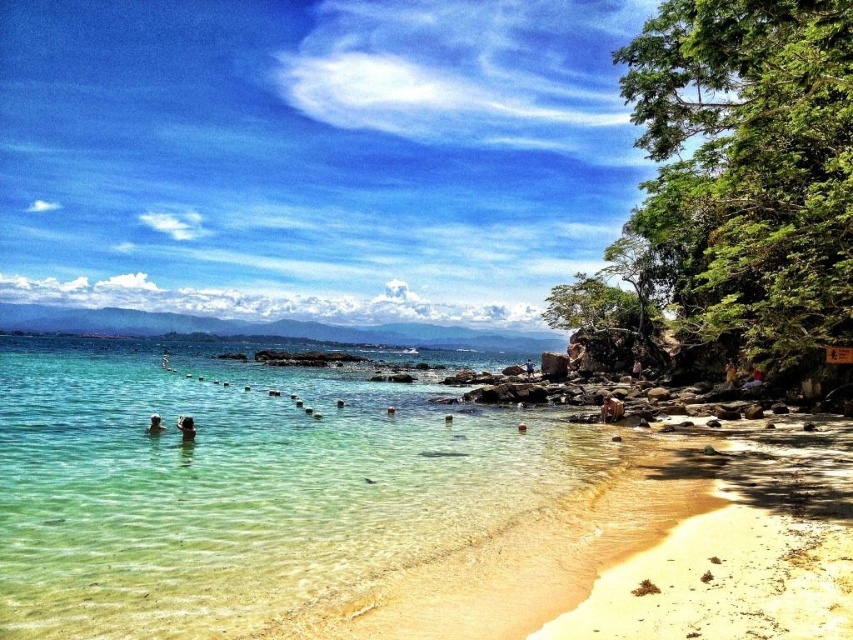
Question: Can you confirm if clear water at beach left is smaller than brown textured person at lower right?

Choices:
 (A) no
 (B) yes

Answer: (A)

Question: Which point is closer to the camera?

Choices:
 (A) (186, 429)
 (B) (157, 420)
 (C) (622, 413)

Answer: (A)

Question: Is brown furry dog at lower right to the left of light brown skin at lower left from the viewer's perspective?

Choices:
 (A) yes
 (B) no

Answer: (B)

Question: In this image, where is brown textured person at lower right located relative to light brown skin at lower left?

Choices:
 (A) right
 (B) left

Answer: (A)

Question: Which point is closer to the camera taking this photo?

Choices:
 (A) (151, 417)
 (B) (730, 358)
 (C) (192, 424)
 (D) (618, 413)

Answer: (C)

Question: Which point is farther from the camera taking this photo?

Choices:
 (A) coord(612,404)
 (B) coord(236,474)

Answer: (A)